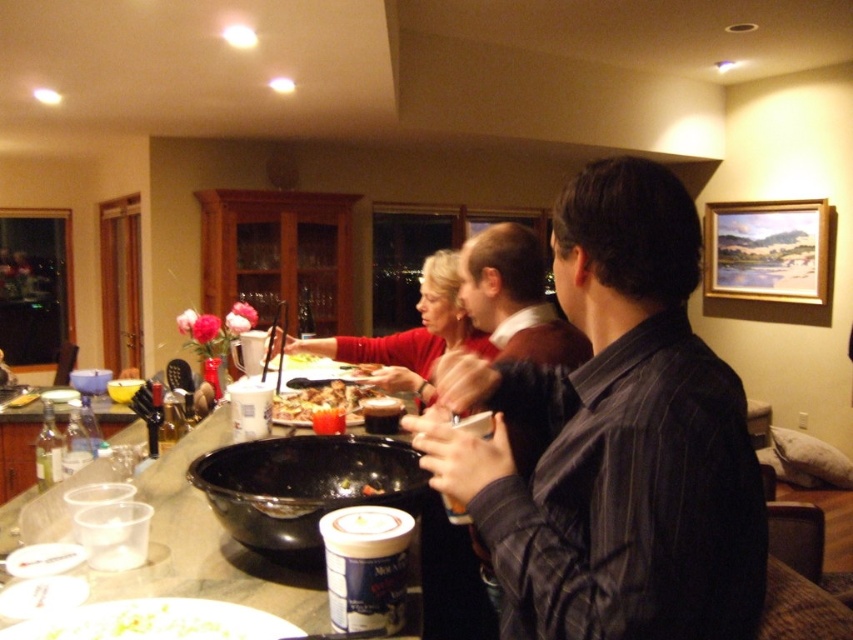
You are at the kitchen counter and want to place a new item at point 0.5, 0.6. Is there enough space between dark gray shirt at center to place it there?

The dark gray shirt at center is located at point (515, 298). The desired placement point (511, 320) is very close, but since the exact dimensions of the shirt and the available space aren not specified, it is uncertain if there is enough space. Please check the physical distance between the shirt and the desired spot.

You are organizing a charity event and need to determine if the matte red sweater at center can fit into the clear glass bottle at counter left. Based on their sizes, what is your assessment?

The matte red sweater at center is larger in size than the clear glass bottle at counter left, so it cannot fit inside the bottle.

You are at the center of the room and see the point marked at coordinates (409,336). What item is located exactly at that point?

The item located exactly at point (409,336) is the matte red sweater at center.